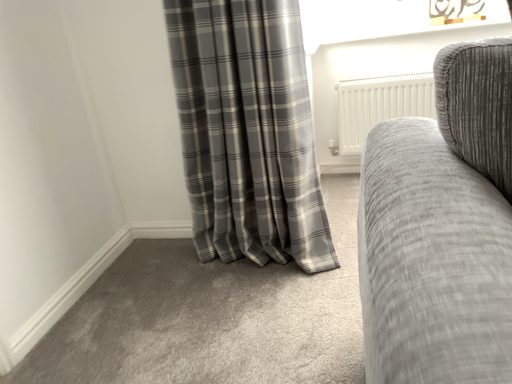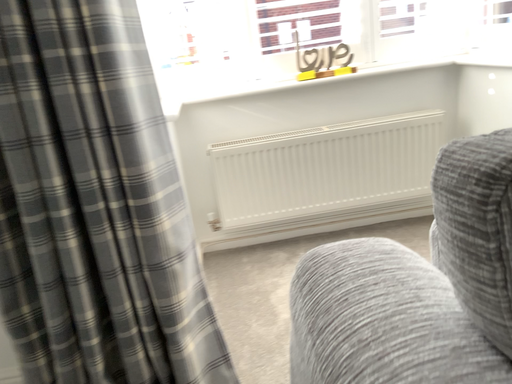
Question: Which way did the camera rotate in the video?

Choices:
 (A) rotated left
 (B) rotated right

Answer: (B)